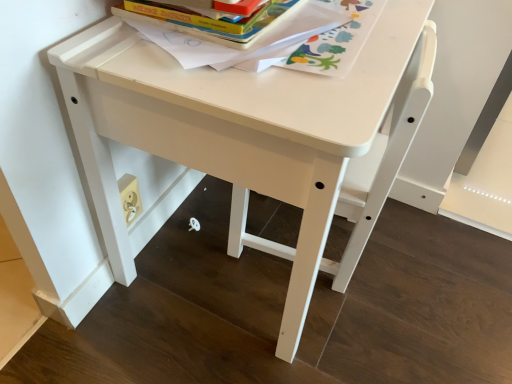
The width and height of the screenshot is (512, 384). What do you see at coordinates (252, 136) in the screenshot?
I see `white matte table at center` at bounding box center [252, 136].

This screenshot has width=512, height=384. I want to click on white matte table at center, so click(252, 136).

Locate an element on the screen. The width and height of the screenshot is (512, 384). hardcover book at upper center is located at coordinates (209, 26).

Is white plastic chair at center taller or shorter than hardcover book at upper center?

white plastic chair at center is taller than hardcover book at upper center.

Would you say white plastic chair at center is a long distance from hardcover book at upper center?

Actually, white plastic chair at center and hardcover book at upper center are a little close together.

Is white plastic chair at center located outside hardcover book at upper center?

white plastic chair at center lies outside hardcover book at upper center's area.

Is point (241, 205) farther from camera compared to point (244, 20)?

Yes, point (241, 205) is farther from viewer.

Find the location of a particular element. This screenshot has width=512, height=384. table above the white plastic chair at center (from the image's perspective) is located at coordinates (252, 136).

In the image, is white matte table at center positioned in front of or behind white plastic chair at center?

Clearly, white matte table at center is in front of white plastic chair at center.

Consider the image. From a real-world perspective, which object stands above the other?

In real-world perspective, white matte table at center is above.

Can you confirm if white matte table at center is shorter than white plastic chair at center?

No.

Considering the sizes of white matte table at center and hardcover book at upper center in the image, is white matte table at center bigger or smaller than hardcover book at upper center?

In the image, white matte table at center appears to be larger than hardcover book at upper center.

Is white matte table at center thinner than hardcover book at upper center?

No.

Is white matte table at center not near hardcover book at upper center?

white matte table at center is near hardcover book at upper center, not far away.

Considering the points (157, 74) and (266, 33), which point is in front, point (157, 74) or point (266, 33)?

The point (157, 74) is closer to the camera.

Does point (249, 237) come in front of point (323, 12)?

No, (249, 237) is further to viewer.

Is white plastic chair at center aimed at hardcover book at upper center?

Yes.

Is white plastic chair at center bigger than hardcover book at upper center?

Correct, white plastic chair at center is larger in size than hardcover book at upper center.

Would you say white plastic chair at center contains hardcover book at upper center?

That's correct, hardcover book at upper center is inside white plastic chair at center.

Between point (333, 21) and point (387, 168), which one is positioned in front?

The point (333, 21) is closer.

This screenshot has width=512, height=384. What are the coordinates of `book behind the white matte table at center` in the screenshot? It's located at (273, 38).

Considering the positions of objects hardcover book at upper center and white matte table at center in the image provided, who is behind, hardcover book at upper center or white matte table at center?

hardcover book at upper center is further from the camera.

Is white matte table at center in contact with hardcover book at upper center?

They are not placed beside each other.

From a real-world perspective, is white matte table at center above or below hardcover book at upper center?

In terms of real-world spatial position, white matte table at center is below hardcover book at upper center.

Which is in front, white matte table at center or hardcover book at upper center?

white matte table at center is in front.

Who is smaller, hardcover book at upper center or white matte table at center?

hardcover book at upper center.

Does hardcover book at upper center have a greater width compared to white matte table at center?

In fact, hardcover book at upper center might be narrower than white matte table at center.

From a real-world perspective, which object stands above the other?

hardcover book at upper center is physically above.

From the image's perspective, is hardcover book at upper center above white matte table at center?

Indeed, from the image's perspective, hardcover book at upper center is shown above white matte table at center.

Locate an element on the screen. Image resolution: width=512 pixels, height=384 pixels. chair that is behind the hardcover book at upper center is located at coordinates (381, 165).

I want to click on table on the left of white plastic chair at center, so click(x=252, y=136).

Considering their positions, is hardcover book at upper center positioned further to hardcover book at upper center than white matte table at center?

Based on the image, white matte table at center appears to be further to hardcover book at upper center.

Considering their positions, is hardcover book at upper center positioned further to white plastic chair at center than hardcover book at upper center?

hardcover book at upper center is positioned further to the anchor white plastic chair at center.

Based on their spatial positions, is white plastic chair at center or white matte table at center closer to hardcover book at upper center?

The object closer to hardcover book at upper center is white matte table at center.

From the image, which object appears to be farther from white matte table at center, hardcover book at upper center or white plastic chair at center?

Among the two, hardcover book at upper center is located further to white matte table at center.

Looking at this image, which object lies further to the anchor point hardcover book at upper center, white matte table at center or hardcover book at upper center?

white matte table at center lies further to hardcover book at upper center than the other object.

When comparing their distances from white matte table at center, does white plastic chair at center or hardcover book at upper center seem further?

hardcover book at upper center.

From the image, which object appears to be nearer to hardcover book at upper center, white matte table at center or hardcover book at upper center?

The object closer to hardcover book at upper center is hardcover book at upper center.

In the scene shown: Considering their positions, is white matte table at center positioned further to hardcover book at upper center than white plastic chair at center?

The object further to hardcover book at upper center is white plastic chair at center.

The height and width of the screenshot is (384, 512). In order to click on table between hardcover book at upper center and white plastic chair at center in the up-down direction in this screenshot , I will do `click(252, 136)`.

Locate an element on the screen. The width and height of the screenshot is (512, 384). paperback book between hardcover book at upper center and white plastic chair at center vertically is located at coordinates (209, 26).

You are a GUI agent. You are given a task and a screenshot of the screen. Output one action in this format:
    pyautogui.click(x=<x>, y=<y>)
    Task: Click on the paperback book that lies between hardcover book at upper center and white matte table at center from top to bottom
    
    Given the screenshot: What is the action you would take?
    pyautogui.click(x=209, y=26)

Where is `table between hardcover book at upper center and white plastic chair at center in the up-down direction`? table between hardcover book at upper center and white plastic chair at center in the up-down direction is located at coordinates (252, 136).